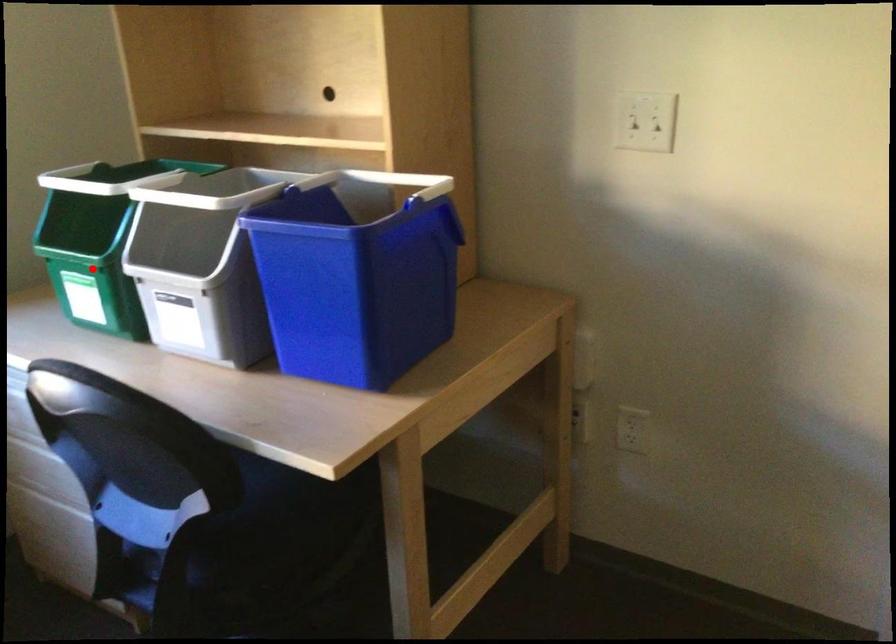
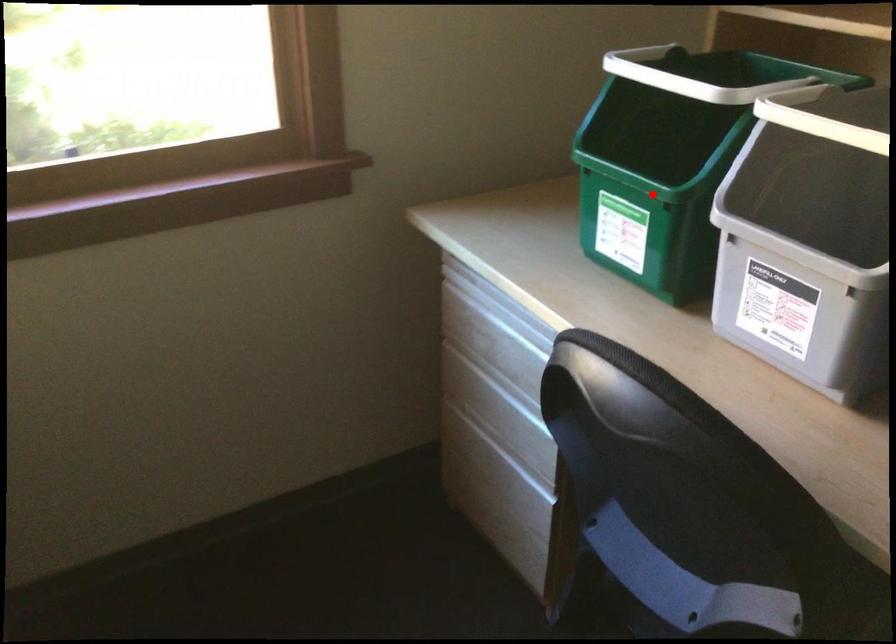
Looking at this image, I am providing you with two images of the same scene from different viewpoints. A red point is marked on the first image and another point is marked on the second image. Is the red point in image1 aligned with the point shown in image2?

Yes